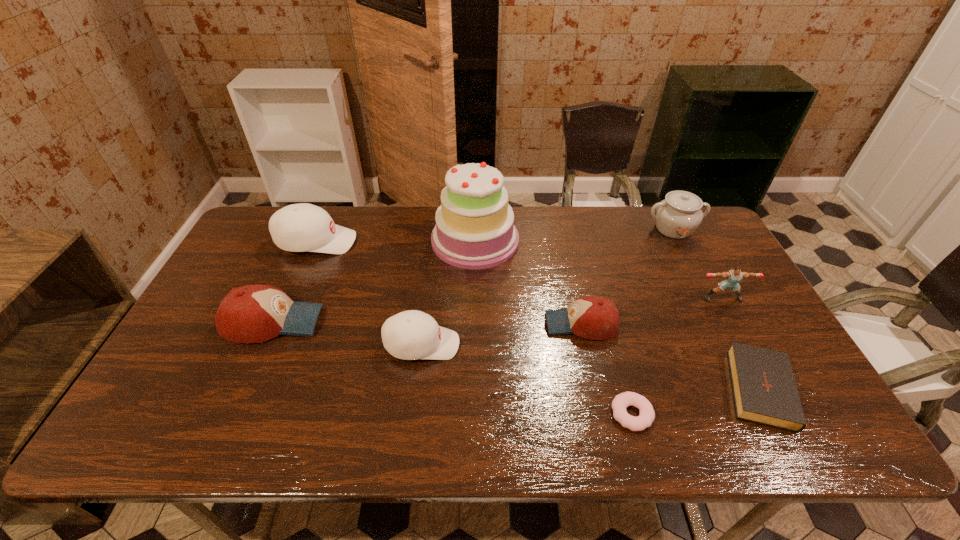
In the image, there is a desktop. Where is `vacant space at the far right corner`? vacant space at the far right corner is located at coordinates (719, 240).

Where is `free region at the near right corner of the desktop`? The image size is (960, 540). free region at the near right corner of the desktop is located at coordinates (823, 444).

At what (x,y) coordinates should I click in order to perform the action: click on vacant area that lies between the shortest object and the left red baseball cap. Please return your answer as a coordinate pair (x, y). This screenshot has width=960, height=540. Looking at the image, I should click on (452, 368).

The height and width of the screenshot is (540, 960). In order to click on vacant space that is in between the smaller red baseball cap and the third baseball cap from left to right in this screenshot , I will do `click(501, 334)`.

I want to click on vacant space that's between the nearer white baseball cap and the cake, so click(x=448, y=292).

You are a GUI agent. You are given a task and a screenshot of the screen. Output one action in this format:
    pyautogui.click(x=<x>, y=<y>)
    Task: Click on the free spot between the tallest object and the rightmost baseball cap
    
    Given the screenshot: What is the action you would take?
    pyautogui.click(x=528, y=282)

The height and width of the screenshot is (540, 960). I want to click on free space between the farthest baseball cap and the eighth tallest object, so click(x=538, y=314).

Locate an element on the screen. The width and height of the screenshot is (960, 540). free spot between the bigger red baseball cap and the doughnut is located at coordinates (452, 368).

Where is `free spot between the left white baseball cap and the puncher`? The width and height of the screenshot is (960, 540). free spot between the left white baseball cap and the puncher is located at coordinates (519, 270).

Locate an element on the screen. free point between the cake and the red puncher is located at coordinates (599, 269).